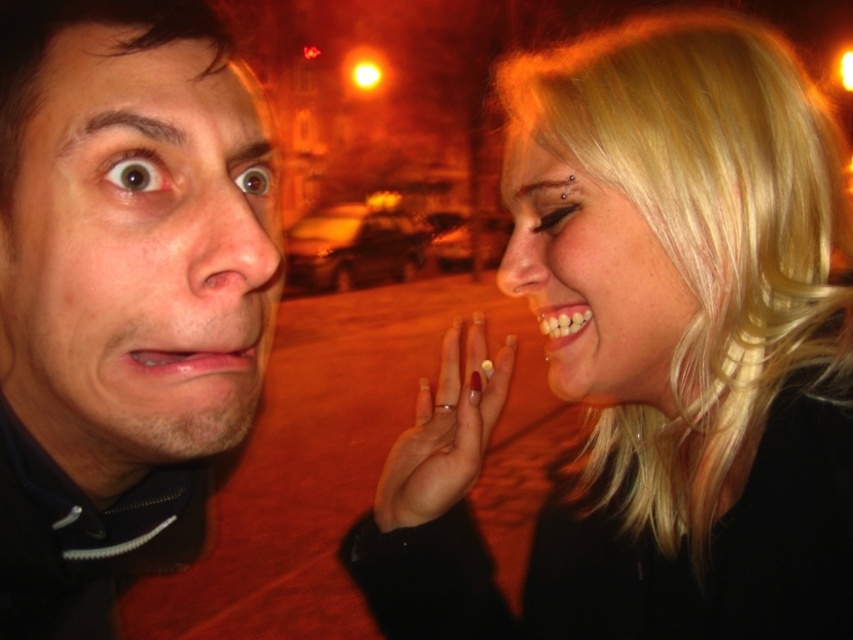
You are a photographer adjusting the focus on your camera. The subject is the smooth skin face at left and the matte skin nose at center. The camera can only focus on one object at a time. Which object should you focus on if you want the closest part of the scene to be in focus?

The smooth skin face at left is closer to the camera than the matte skin nose at center because they are 2.01 inches apart. Therefore, you should focus on the smooth skin face at left to capture the closest part in focus.

You are a photographer setting up for a portrait shoot. You need to ensure that the blonde hair at upper right and the white matte ring at center are at least 5 inches apart to avoid overlapping in the final shot. Based on the scene description, will their current positions meet this requirement?

The blonde hair at upper right is 4.89 inches away from the white matte ring at center, which is less than the required 5 inches. Therefore, their current positions do not meet the requirement and may cause overlapping in the final shot.

You are an artist sketching this scene. You need to decide which object to draw first based on their sizes. Which one should you start with, the blonde hair at upper right or the white matte ring at center?

The blonde hair at upper right is larger in size than the white matte ring at center, so you should start with the blonde hair at upper right since it requires more space on the paper.